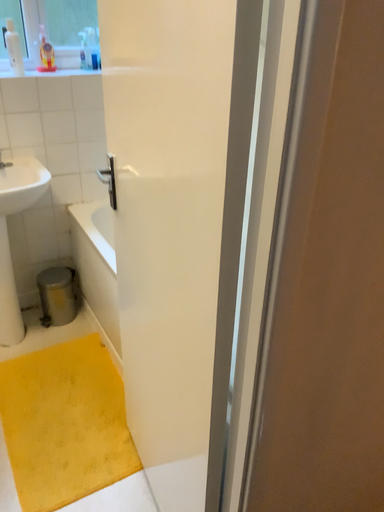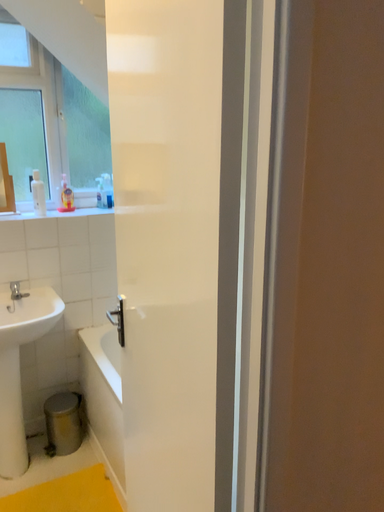
Question: How did the camera likely rotate when shooting the video?

Choices:
 (A) rotated downward
 (B) rotated upward

Answer: (B)